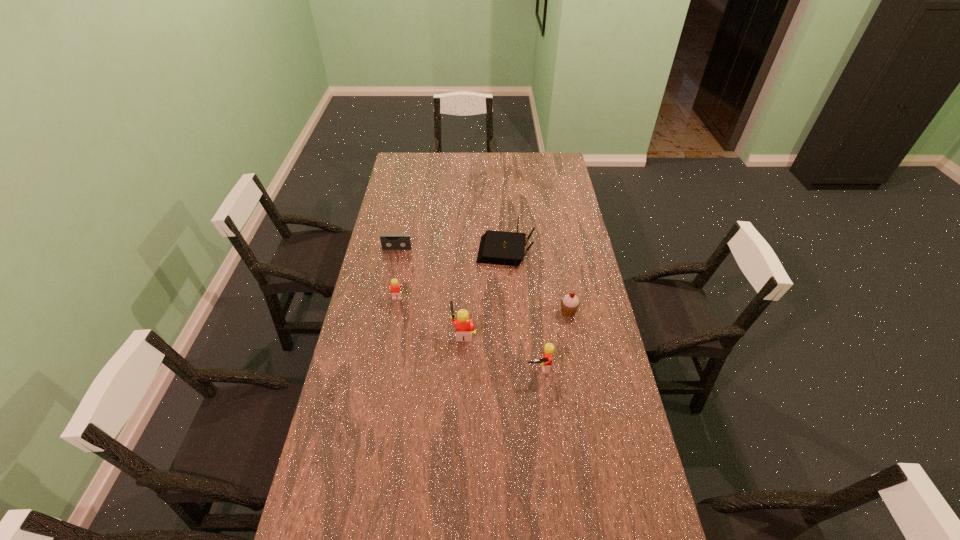
Identify the location of vacant point located between the cupcake and the second shortest Lego. The width and height of the screenshot is (960, 540). (554, 340).

Identify the location of empty space between the rightmost object and the shortest object. The image size is (960, 540). coord(483,280).

Image resolution: width=960 pixels, height=540 pixels. In order to click on free space between the cupcake and the router in this screenshot , I will do `click(537, 282)`.

Identify the location of free space between the shortest object and the tallest Lego. This screenshot has width=960, height=540. (430, 291).

Where is `object that ranks as the closest to the router`? object that ranks as the closest to the router is located at coordinates (570, 303).

Identify which object is located as the fourth nearest to the rightmost object. Please provide its 2D coordinates. Your answer should be formatted as a tuple, i.e. [(x, y)], where the tuple contains the x and y coordinates of a point satisfying the conditions above.

[(396, 289)]

The width and height of the screenshot is (960, 540). I want to click on Lego identified as the second closest to the shortest Lego, so click(546, 362).

Identify the location of Lego that is the third closest to the router. (546, 362).

Where is `vacant area in the image that satisfies the following two spatial constraints: 1. on the front-facing side of the videotape; 2. on the right side of the cupcake`? This screenshot has height=540, width=960. vacant area in the image that satisfies the following two spatial constraints: 1. on the front-facing side of the videotape; 2. on the right side of the cupcake is located at coordinates (384, 312).

Locate an element on the screen. vacant region that satisfies the following two spatial constraints: 1. in front of the cupcake with the accessory visible; 2. on the left side of the leftmost Lego is located at coordinates (396, 312).